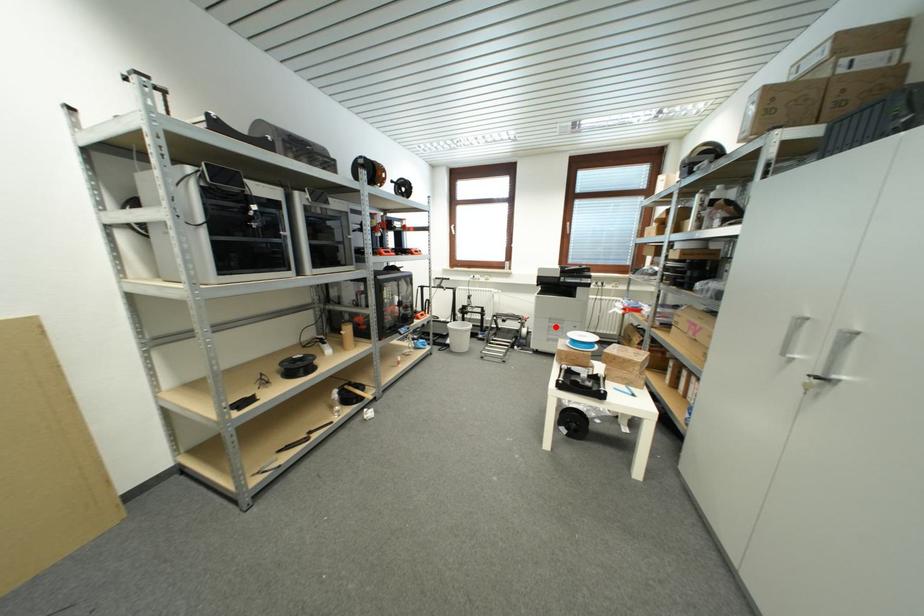
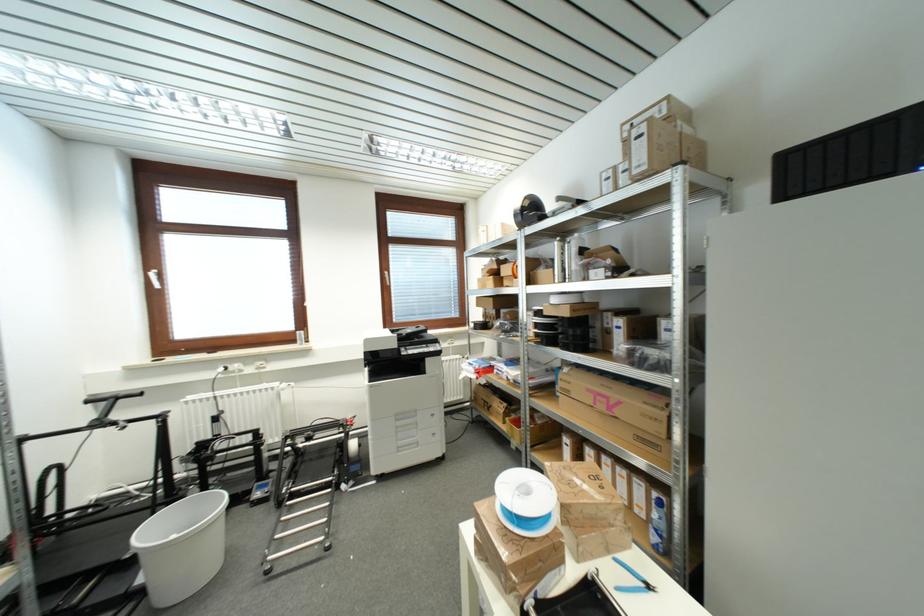
Question: I am providing you with two images of the same scene from different viewpoints. A red point is marked on the first image. Can you still see the location of the red point in image 2?

Choices:
 (A) Yes
 (B) No

Answer: (A)